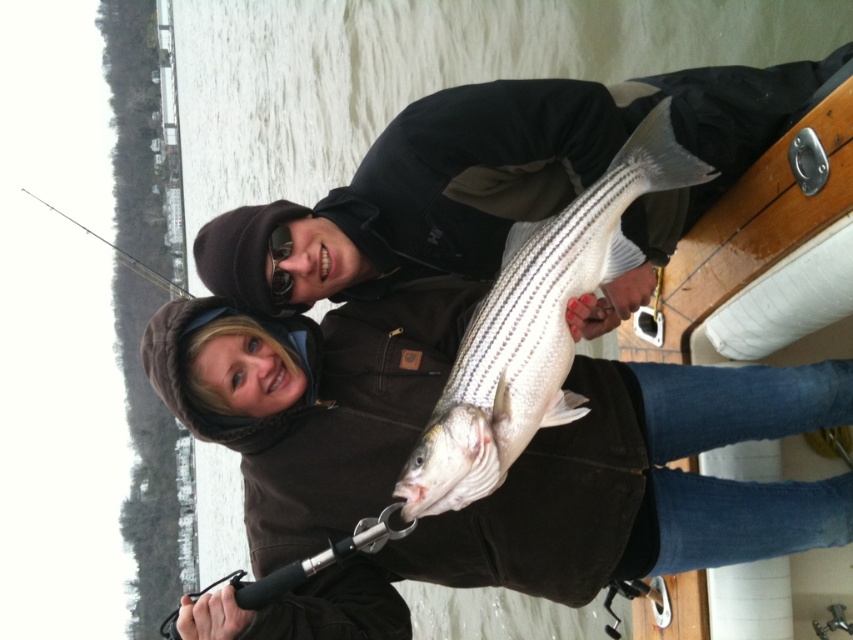
Between white striped fish at center and clear glass fishing pole at left, which one appears on the right side from the viewer's perspective?

white striped fish at center

Does white striped fish at center have a greater width compared to clear glass fishing pole at left?

In fact, white striped fish at center might be narrower than clear glass fishing pole at left.

Is point (589, 221) farther from camera compared to point (149, 269)?

No, (589, 221) is closer to viewer.

You are a GUI agent. You are given a task and a screenshot of the screen. Output one action in this format:
    pyautogui.click(x=<x>, y=<y>)
    Task: Click on the white striped fish at center
    
    Given the screenshot: What is the action you would take?
    pyautogui.click(x=535, y=326)